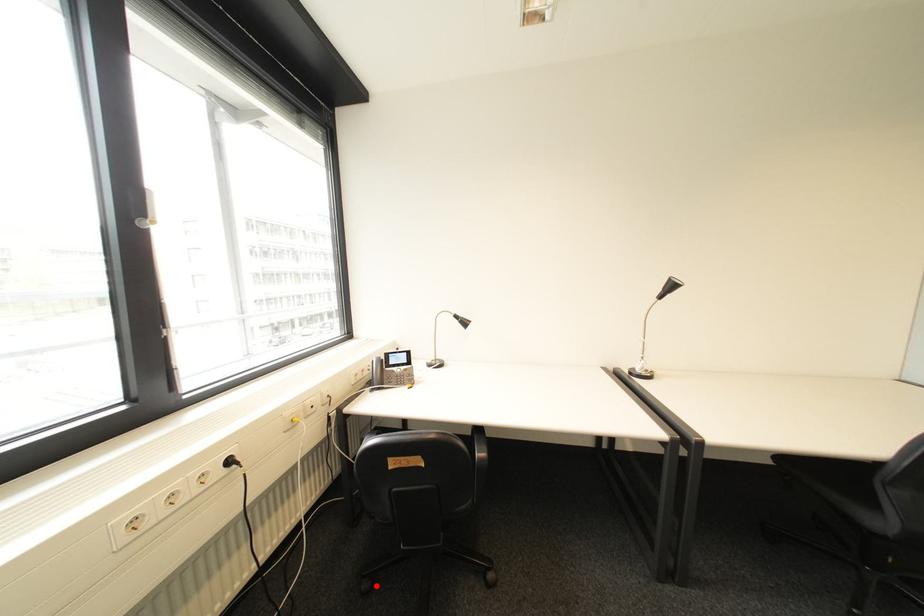
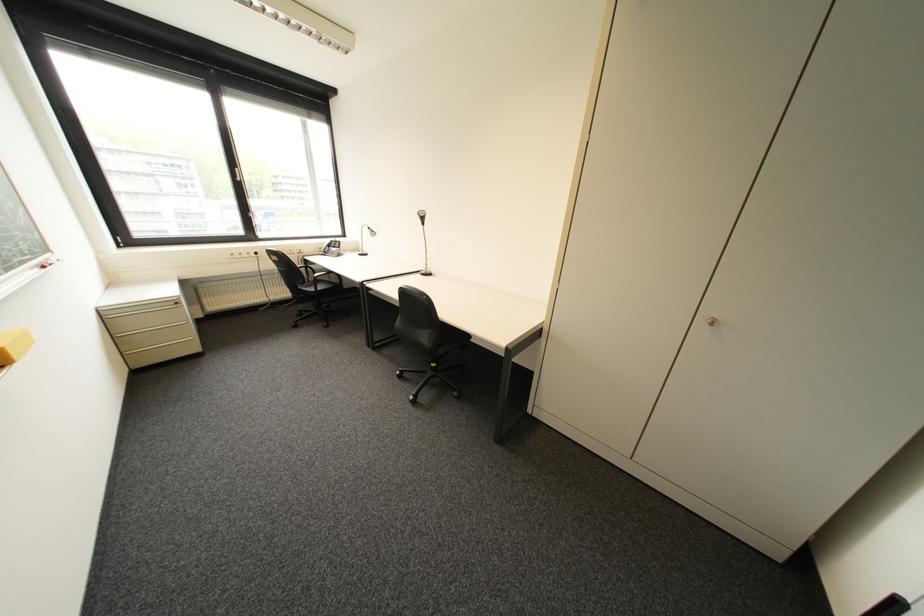
Where in the second image is the point corresponding to the highlighted location from the first image?

(309, 314)